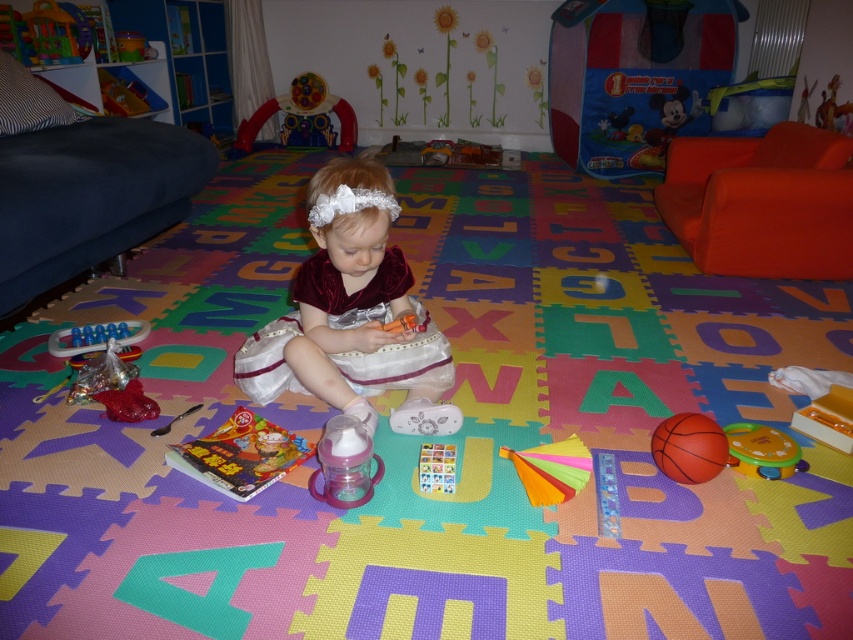
You are a parent in the room and want to place a new toy on the floor near the pink plastic sippy cup at center. Where should you place it to ensure it is close to the sippy cup?

Place the new toy near the coordinates of the pink plastic sippy cup at center, which is at point (345, 464), to ensure it is close.

You are a parent trying to organize the playroom. You want to place a new toy box between the plastic colorful arch at upper center and the rubberized plastic toy at lower left. Can you fit the toy box there?

The plastic colorful arch at upper center is located above the rubberized plastic toy at lower left, so there is vertical space between them. However, since the toy box requires horizontal space, it might not fit if the objects are stacked vertically. Please check the horizontal distance between them before placing the toy box.